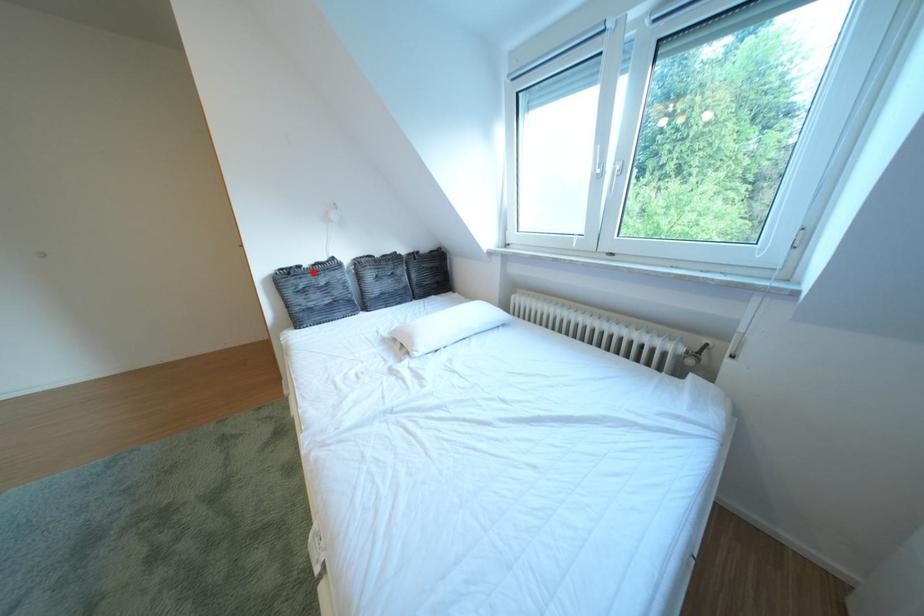
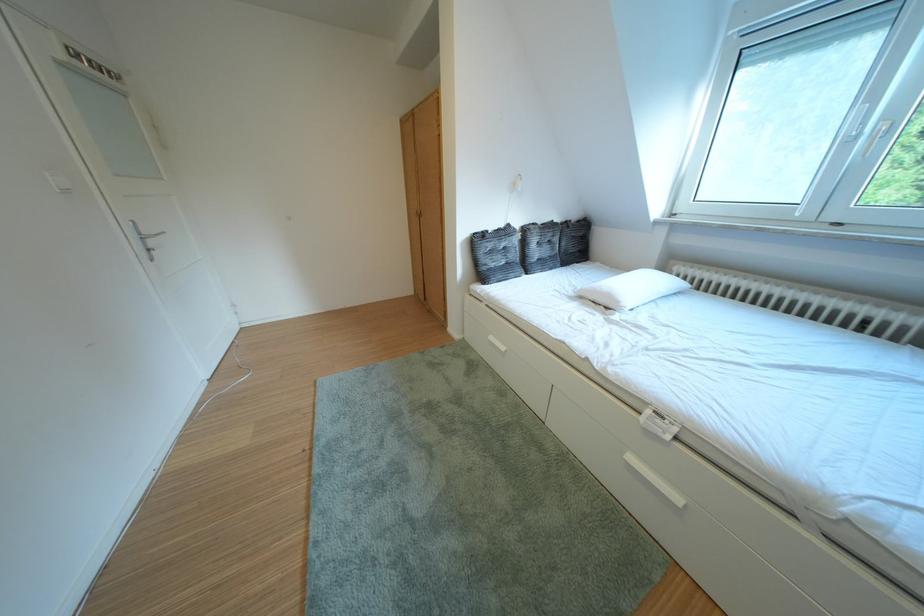
The point at the highlighted location is marked in the first image. Where is the corresponding point in the second image?

(500, 237)